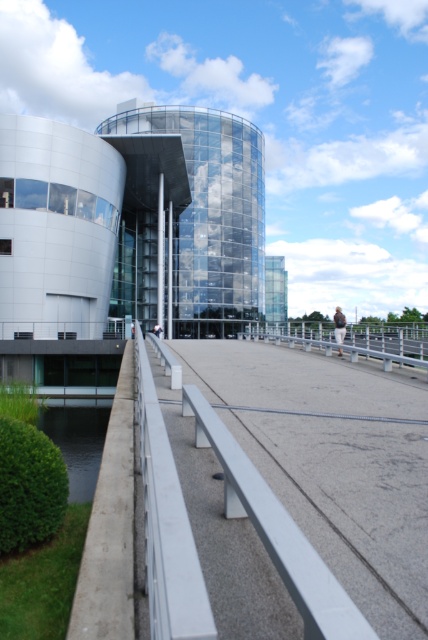
Question: Which of the following is the farthest from the observer?

Choices:
 (A) (404, 579)
 (B) (272, 339)

Answer: (B)

Question: Is smooth concrete path at center positioned at the back of silver metallic rail at center?

Choices:
 (A) yes
 (B) no

Answer: (B)

Question: Is smooth concrete path at center bigger than silver metallic rail at center?

Choices:
 (A) no
 (B) yes

Answer: (A)

Question: Is smooth concrete path at center thinner than silver metallic rail at center?

Choices:
 (A) yes
 (B) no

Answer: (B)